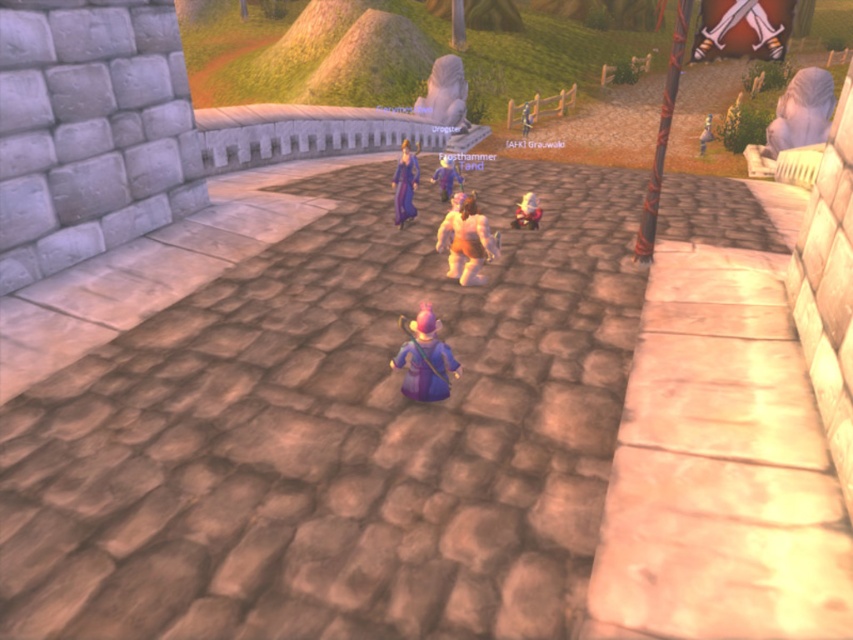
Can you confirm if orange fur-like creature at center is positioned above purple velvet robe at center?

No, orange fur-like creature at center is not above purple velvet robe at center.

Is orange fur-like creature at center to the right of purple velvet robe at center from the viewer's perspective?

Indeed, orange fur-like creature at center is positioned on the right side of purple velvet robe at center.

Where is `orange fur-like creature at center`? orange fur-like creature at center is located at coordinates (466, 241).

Is point (397, 164) positioned in front of point (537, 218)?

No, it is not.

I want to click on purple velvet robe at center, so click(x=404, y=184).

Where is `purple velvet robe at center`? This screenshot has width=853, height=640. purple velvet robe at center is located at coordinates (404, 184).

Between purple velvet staff at center and purple velvet robe at center, which one appears on the left side from the viewer's perspective?

purple velvet robe at center

Between purple velvet staff at center and purple velvet robe at center, which one has more height?

Standing taller between the two is purple velvet robe at center.

Is point (398, 368) positioned in front of point (405, 164)?

Yes, point (398, 368) is in front of point (405, 164).

The image size is (853, 640). What are the coordinates of `purple velvet staff at center` in the screenshot? It's located at (424, 358).